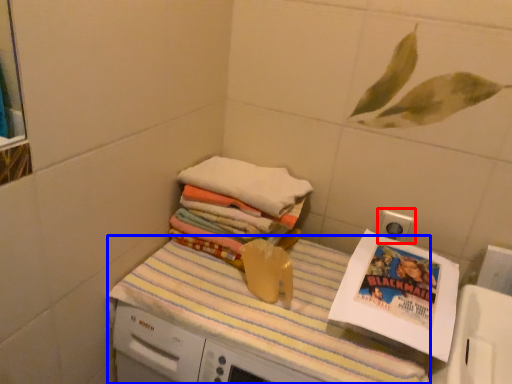
Question: Among these objects, which one is nearest to the camera, electric outlet (highlighted by a red box) or tablecloth (highlighted by a blue box)?

Choices:
 (A) electric outlet
 (B) tablecloth

Answer: (B)